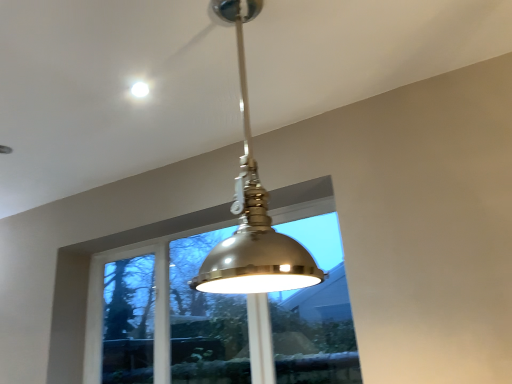
Question: Is metallic dome at center located outside metallic dome at upper center?

Choices:
 (A) yes
 (B) no

Answer: (A)

Question: Does metallic dome at center appear on the left side of metallic dome at upper center?

Choices:
 (A) no
 (B) yes

Answer: (A)

Question: Does metallic dome at center have a lesser height compared to metallic dome at upper center?

Choices:
 (A) no
 (B) yes

Answer: (A)

Question: Is metallic dome at upper center at the back of metallic dome at center?

Choices:
 (A) yes
 (B) no

Answer: (B)

Question: Considering the relative sizes of metallic dome at center and metallic dome at upper center in the image provided, is metallic dome at center thinner than metallic dome at upper center?

Choices:
 (A) yes
 (B) no

Answer: (B)

Question: Is metallic dome at center in front of metallic dome at upper center?

Choices:
 (A) yes
 (B) no

Answer: (A)

Question: Is clear glass window at center facing away from metallic dome at center?

Choices:
 (A) yes
 (B) no

Answer: (B)

Question: Is clear glass window at center not near metallic dome at center?

Choices:
 (A) yes
 (B) no

Answer: (A)

Question: Is clear glass window at center behind metallic dome at center?

Choices:
 (A) yes
 (B) no

Answer: (A)

Question: Considering the relative sizes of clear glass window at center and metallic dome at center in the image provided, is clear glass window at center taller than metallic dome at center?

Choices:
 (A) yes
 (B) no

Answer: (A)

Question: Are clear glass window at center and metallic dome at center beside each other?

Choices:
 (A) no
 (B) yes

Answer: (A)

Question: Is clear glass window at center shorter than metallic dome at center?

Choices:
 (A) yes
 (B) no

Answer: (B)

Question: Is there a large distance between metallic dome at upper center and clear glass window at center?

Choices:
 (A) yes
 (B) no

Answer: (A)